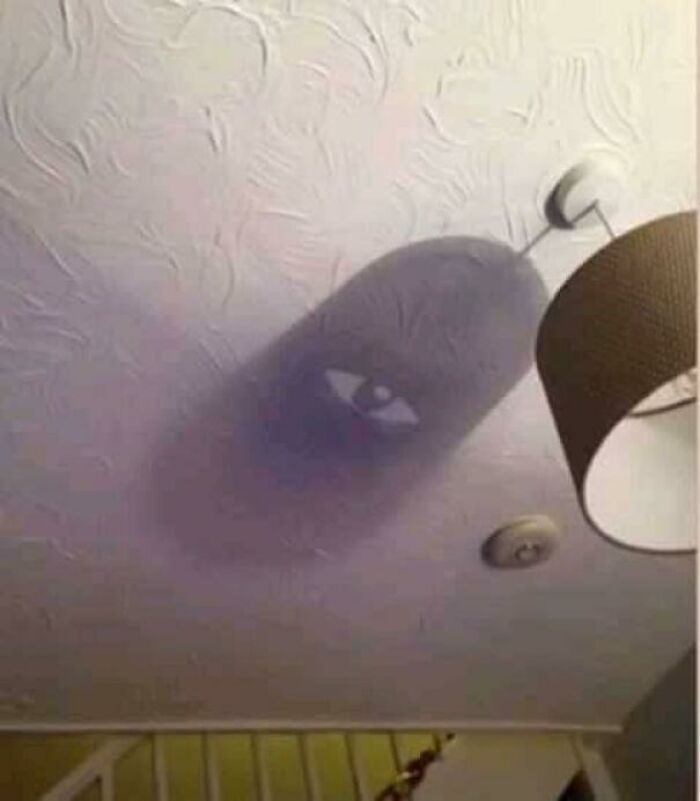
This screenshot has width=700, height=801. What are the coordinates of `smoke alarm` in the screenshot? It's located at (524, 548).